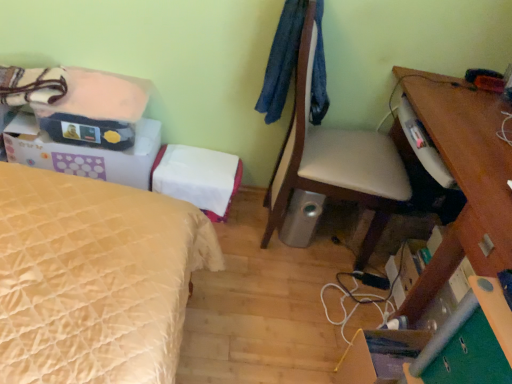
Question: Is green felt drawer at lower right wider or thinner than silver metallic speaker at lower center?

Choices:
 (A) thin
 (B) wide

Answer: (A)

Question: Would you say green felt drawer at lower right is to the left or to the right of silver metallic speaker at lower center in the picture?

Choices:
 (A) left
 (B) right

Answer: (B)

Question: Considering the real-world distances, which object is closest to the white leather chair at center?

Choices:
 (A) green felt drawer at lower right
 (B) silver metallic speaker at lower center
 (C) matte cardboard box at lower right, which is counted as the third storage box, starting from the left
 (D) white cardboard box at upper left, acting as the 1th storage box starting from the left
 (E) white fabric storage box at center, which is counted as the second storage box, starting from the top

Answer: (B)

Question: Which object is positioned closest to the wooden desk at right?

Choices:
 (A) white leather chair at center
 (B) white fabric storage box at center, the 2th storage box when ordered from right to left
 (C) white cardboard box at upper left, acting as the 1th storage box starting from the left
 (D) silver metallic speaker at lower center
 (E) matte black bag at upper left

Answer: (A)